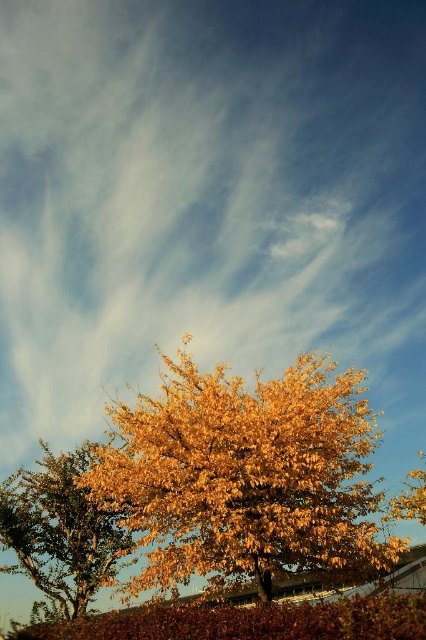
You are an artist planning to paint the scene. You want to ensure the golden leafy tree at center and the golden textured leaves at lower left are proportionally accurate. Which object should you paint wider?

The golden textured leaves at lower left should be painted wider since the golden leafy tree at center has a lesser width compared to them.

You are an artist sketching the scene. You need to place the golden leafy tree at center and the golden textured leaves at lower left in your drawing. According to the scene, which object should be positioned to the right side of the other?

The golden leafy tree at center should be positioned to the right of the golden textured leaves at lower left.

You are standing in the scene and want to take a photo of the golden leafy tree at center. To ensure the tree is centered in your viewfinder, where should you position yourself relative to the tree?

Since the golden leafy tree at center is located at coordinates approximately 0.744 on the x and 0.575 on the y axis, you should position yourself slightly to the left and lower than the tree to center it in your viewfinder.